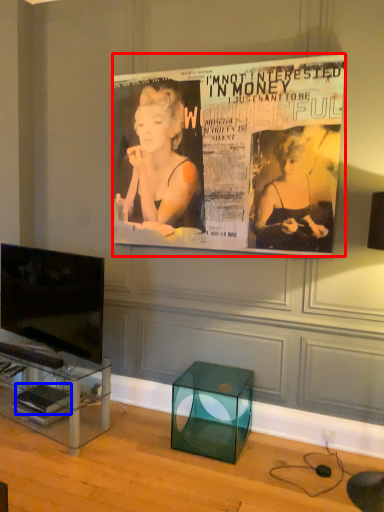
Question: Which of the following is the farthest to the observer, poster (highlighted by a red box) or magazine (highlighted by a blue box)?

Choices:
 (A) poster
 (B) magazine

Answer: (B)